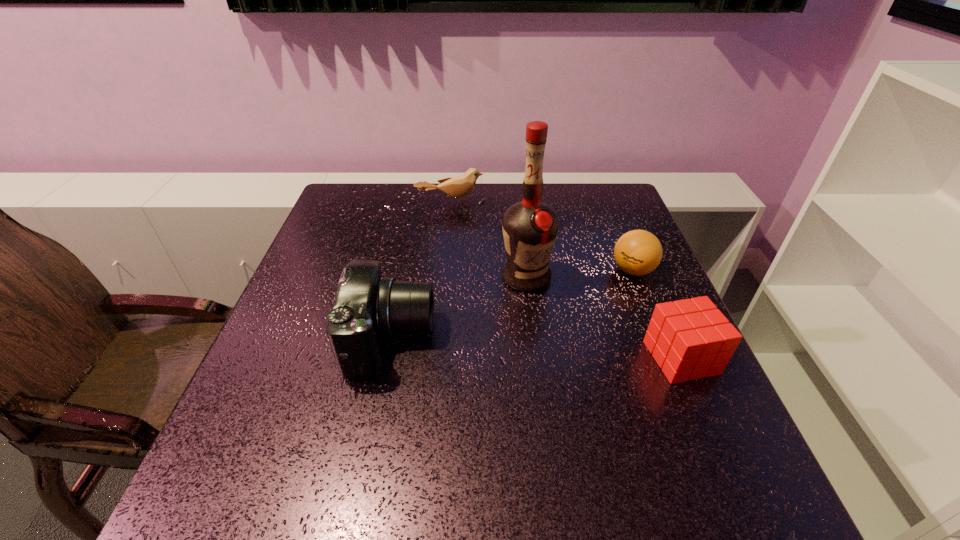
Image resolution: width=960 pixels, height=540 pixels. In order to click on vacant region between the ping-pong ball and the liquor in this screenshot , I will do `click(579, 274)`.

Find the location of a particular element. This screenshot has height=540, width=960. free space between the camera and the cube is located at coordinates (536, 348).

Find the location of `free space that is in between the farthest object and the cube`. free space that is in between the farthest object and the cube is located at coordinates (566, 281).

What are the coordinates of `free area in between the tallest object and the ping-pong ball` in the screenshot? It's located at (579, 274).

Where is `free space between the cube and the liquor`? free space between the cube and the liquor is located at coordinates (603, 318).

Locate which object is the fourth closest to the cube. Please provide its 2D coordinates. Your answer should be formatted as a tuple, i.e. [(x, y)], where the tuple contains the x and y coordinates of a point satisfying the conditions above.

[(458, 187)]

Select which object is the second closest to the ping-pong ball. Please provide its 2D coordinates. Your answer should be formatted as a tuple, i.e. [(x, y)], where the tuple contains the x and y coordinates of a point satisfying the conditions above.

[(690, 339)]

Image resolution: width=960 pixels, height=540 pixels. What are the coordinates of `blank space that satisfies the following two spatial constraints: 1. on the back side of the ping-pong ball; 2. on the left side of the liquor` in the screenshot? It's located at (525, 270).

Locate an element on the screen. This screenshot has height=540, width=960. free point that satisfies the following two spatial constraints: 1. on the front side of the tallest object; 2. on the right side of the cube is located at coordinates (535, 357).